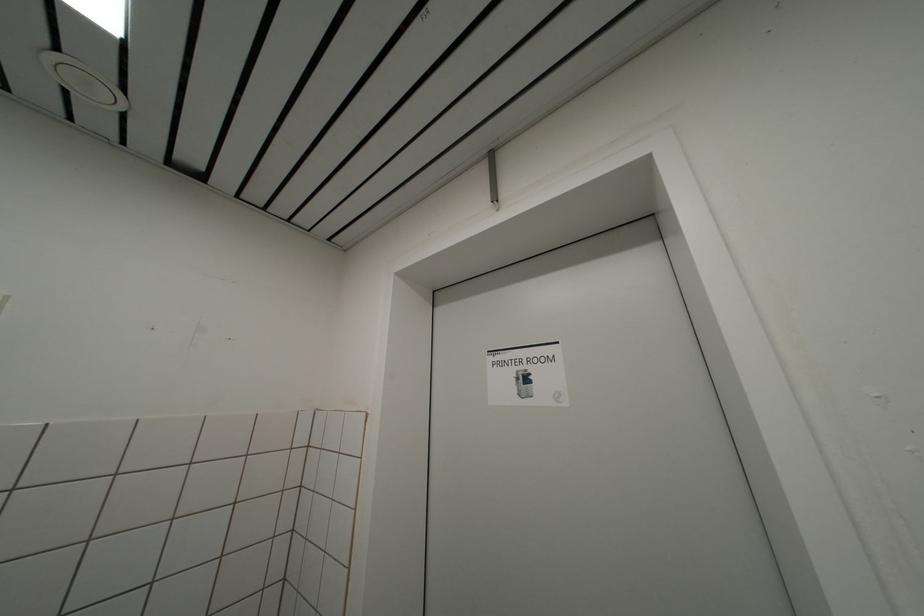
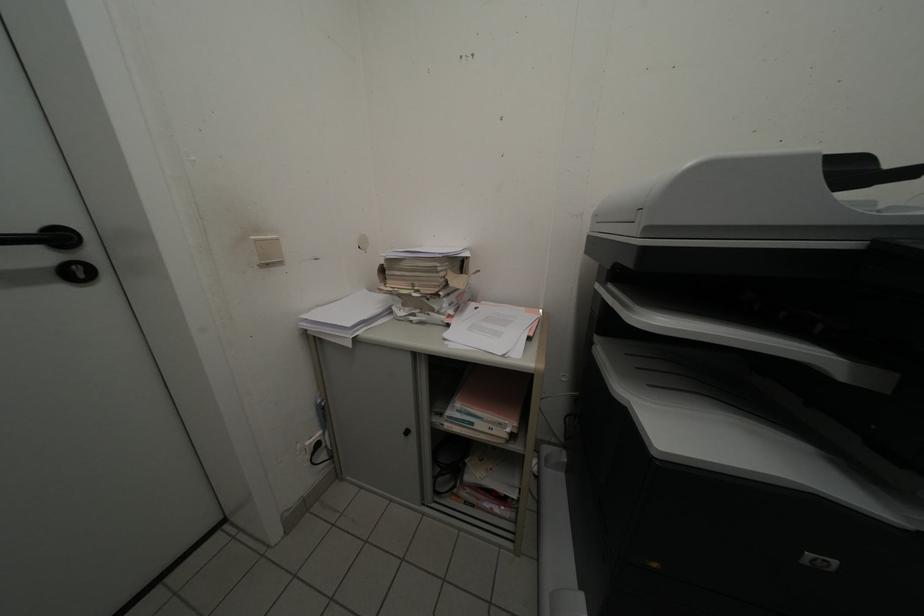
Question: Based on the continuous images, in which direction is the camera rotating? Reply with the corresponding letter.

Choices:
 (A) Left
 (B) Right
 (C) Up
 (D) Down

Answer: (B)